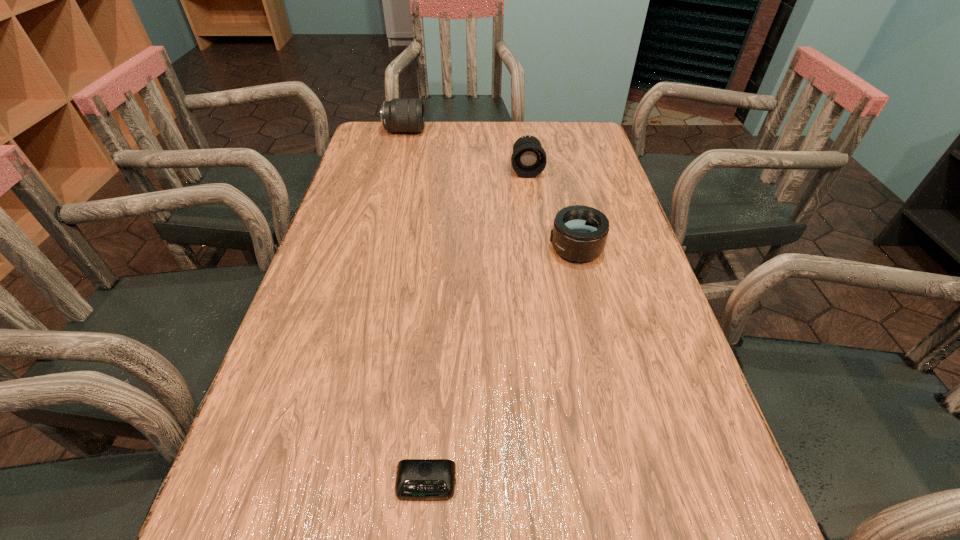
Find the location of a particular element. The image size is (960, 540). the farthest object is located at coordinates (400, 114).

The width and height of the screenshot is (960, 540). In order to click on the farthest telephoto lens in this screenshot , I will do pos(400,114).

Identify the location of the second farthest telephoto lens. [529, 159].

At what (x,y) coordinates should I click in order to perform the action: click on the nearest telephoto lens. Please return your answer as a coordinate pair (x, y). The width and height of the screenshot is (960, 540). Looking at the image, I should click on (579, 233).

The width and height of the screenshot is (960, 540). Find the location of `the third farthest object`. the third farthest object is located at coordinates (579, 233).

Locate an element on the screen. alarm clock is located at coordinates (417, 479).

This screenshot has height=540, width=960. I want to click on the second object from left to right, so click(x=417, y=479).

The image size is (960, 540). Find the location of `vacant space located on the surface of the farthest telephoto lens`. vacant space located on the surface of the farthest telephoto lens is located at coordinates (482, 131).

In order to click on vacant space located 0.380m at the front element of the third nearest object in this screenshot , I will do `click(541, 272)`.

Find the location of a particular element. free region located on the side of the second nearest object with brand markings and control switches is located at coordinates (486, 248).